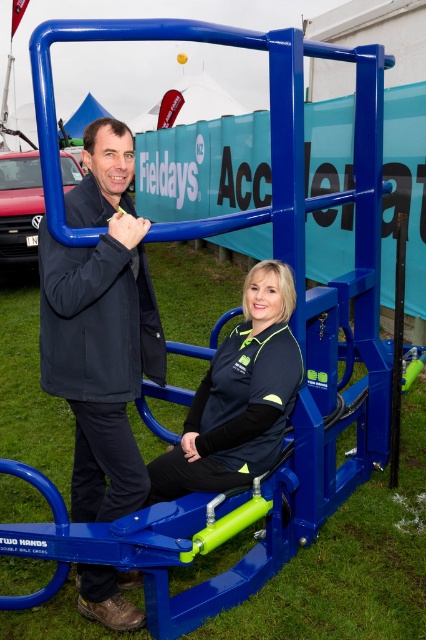
Can you confirm if matte blue exercise machine at center is shorter than matte black jacket at center?

No, matte blue exercise machine at center is not shorter than matte black jacket at center.

Is matte blue exercise machine at center further to the viewer compared to matte black jacket at center?

No.

Between point (123, 397) and point (141, 248), which one is positioned behind?

Positioned behind is point (141, 248).

The width and height of the screenshot is (426, 640). Find the location of `matte blue exercise machine at center`. matte blue exercise machine at center is located at coordinates (100, 326).

Is matte blue exercise machine at center to the left of black fabric jacket at center from the viewer's perspective?

Indeed, matte blue exercise machine at center is positioned on the left side of black fabric jacket at center.

Who is more distant from viewer, (92,150) or (241,355)?

Point (241,355)

Does point (62, 396) lie in front of point (244, 371)?

Yes, it is in front of point (244, 371).

Where is `matte blue exercise machine at center`? The height and width of the screenshot is (640, 426). matte blue exercise machine at center is located at coordinates (100, 326).

Can you confirm if matte black jacket at center is positioned below black fabric jacket at center?

No, matte black jacket at center is not below black fabric jacket at center.

Is matte black jacket at center positioned behind black fabric jacket at center?

No, matte black jacket at center is in front of black fabric jacket at center.

What are the coordinates of `matte black jacket at center` in the screenshot? It's located at (100, 326).

Identify the location of matte black jacket at center. Image resolution: width=426 pixels, height=640 pixels. (100, 326).